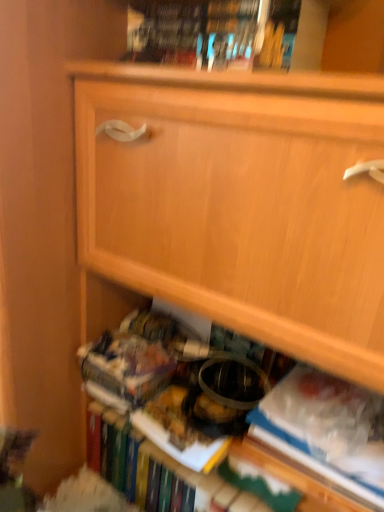
What is the approximate width of hardcover book at upper center?

It is 7.78 inches.

You are a GUI agent. You are given a task and a screenshot of the screen. Output one action in this format:
    pyautogui.click(x=<x>, y=<y>)
    Task: Click on the hardcover book at upper center
    The width and height of the screenshot is (384, 512).
    Given the screenshot: What is the action you would take?
    pyautogui.click(x=227, y=33)

This screenshot has height=512, width=384. Describe the element at coordinates (227, 33) in the screenshot. I see `hardcover book at upper center` at that location.

What is the approximate height of white paper at lower right?

4.76 inches.

What do you see at coordinates (329, 428) in the screenshot?
I see `white paper at lower right` at bounding box center [329, 428].

Locate an element on the screen. Image resolution: width=384 pixels, height=512 pixels. white paper at lower right is located at coordinates (329, 428).

I want to click on hardcover book at upper center, so click(227, 33).

Is white paper at lower right to the left or to the right of hardcover book at upper center in the image?

white paper at lower right is positioned on hardcover book at upper center's right side.

Considering their positions, is white paper at lower right located in front of or behind hardcover book at upper center?

Visually, white paper at lower right is located behind hardcover book at upper center.

Considering the positions of points (378, 436) and (268, 29), is point (378, 436) closer to camera compared to point (268, 29)?

No, (378, 436) is behind (268, 29).

From the image's perspective, between white paper at lower right and hardcover book at upper center, which one is located above?

From the image's view, hardcover book at upper center is above.

From a real-world perspective, which is physically above, white paper at lower right or hardcover book at upper center?

hardcover book at upper center.

Based on the photo, considering the sizes of objects white paper at lower right and hardcover book at upper center in the image provided, who is thinner, white paper at lower right or hardcover book at upper center?

white paper at lower right is thinner.

Who is taller, white paper at lower right or hardcover book at upper center?

white paper at lower right is taller.

From the picture: Is white paper at lower right bigger than hardcover book at upper center?

Actually, white paper at lower right might be smaller than hardcover book at upper center.

From the picture: Is white paper at lower right inside or outside of hardcover book at upper center?

white paper at lower right is not inside hardcover book at upper center, it's outside.

Is white paper at lower right beside hardcover book at upper center?

white paper at lower right is not next to hardcover book at upper center, and they're not touching.

Could you tell me if white paper at lower right is facing hardcover book at upper center?

No.

At what (x,y) coordinates should I click in order to perform the action: click on book in front of the white paper at lower right. Please return your answer as a coordinate pair (x, y). The image size is (384, 512). Looking at the image, I should click on (227, 33).

Between hardcover book at upper center and white paper at lower right, which one appears on the right side from the viewer's perspective?

white paper at lower right is more to the right.

Does hardcover book at upper center lie in front of white paper at lower right?

Yes, hardcover book at upper center is closer to the viewer.

Between point (174, 24) and point (326, 390), which one is positioned in front?

Positioned in front is point (174, 24).

From the image's perspective, who appears lower, hardcover book at upper center or white paper at lower right?

white paper at lower right, from the image's perspective.

Based on the photo, from a real-world perspective, which is physically above, hardcover book at upper center or white paper at lower right?

In real-world perspective, hardcover book at upper center is above.

Considering the relative sizes of hardcover book at upper center and white paper at lower right in the image provided, is hardcover book at upper center thinner than white paper at lower right?

No, hardcover book at upper center is not thinner than white paper at lower right.

Considering the sizes of objects hardcover book at upper center and white paper at lower right in the image provided, who is shorter, hardcover book at upper center or white paper at lower right?

hardcover book at upper center.

Can you confirm if hardcover book at upper center is bigger than white paper at lower right?

Yes, hardcover book at upper center is bigger than white paper at lower right.

Can white paper at lower right be found inside hardcover book at upper center?

No, hardcover book at upper center does not contain white paper at lower right.

Consider the image. Are hardcover book at upper center and white paper at lower right far apart?

A: That's not correct — hardcover book at upper center is a little close to white paper at lower right.

Looking at this image, is white paper at lower right at the back of hardcover book at upper center?

That's not correct — hardcover book at upper center is not looking away from white paper at lower right.

How different are the orientations of hardcover book at upper center and white paper at lower right in degrees?

The facing directions of hardcover book at upper center and white paper at lower right are 1.57 degrees apart.

The image size is (384, 512). I want to click on paperback book located underneath the hardcover book at upper center (from a real-world perspective), so point(329,428).

Where is `book above the white paper at lower right (from the image's perspective)`? The image size is (384, 512). book above the white paper at lower right (from the image's perspective) is located at coordinates (227, 33).

At what (x,y) coordinates should I click in order to perform the action: click on book on the left of white paper at lower right. Please return your answer as a coordinate pair (x, y). Looking at the image, I should click on (227, 33).